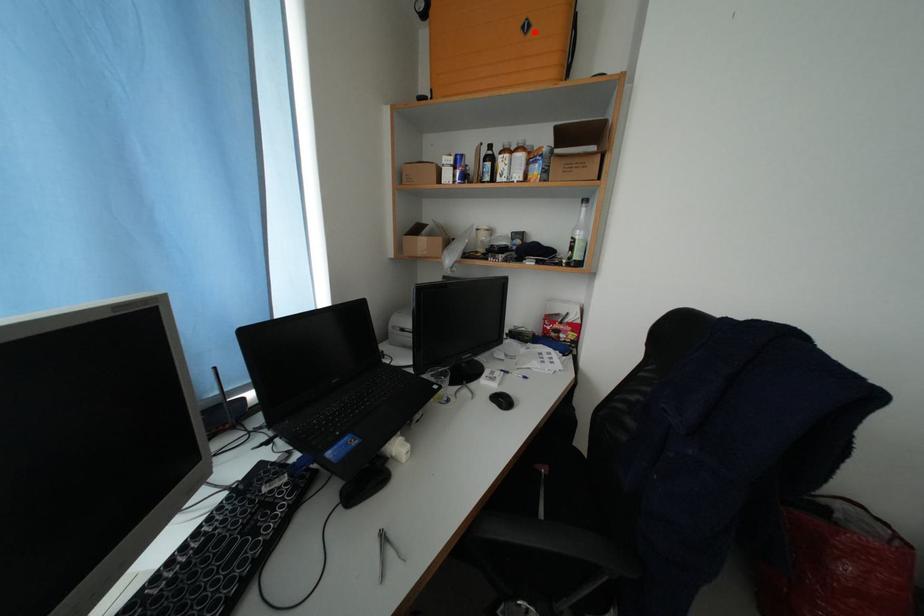
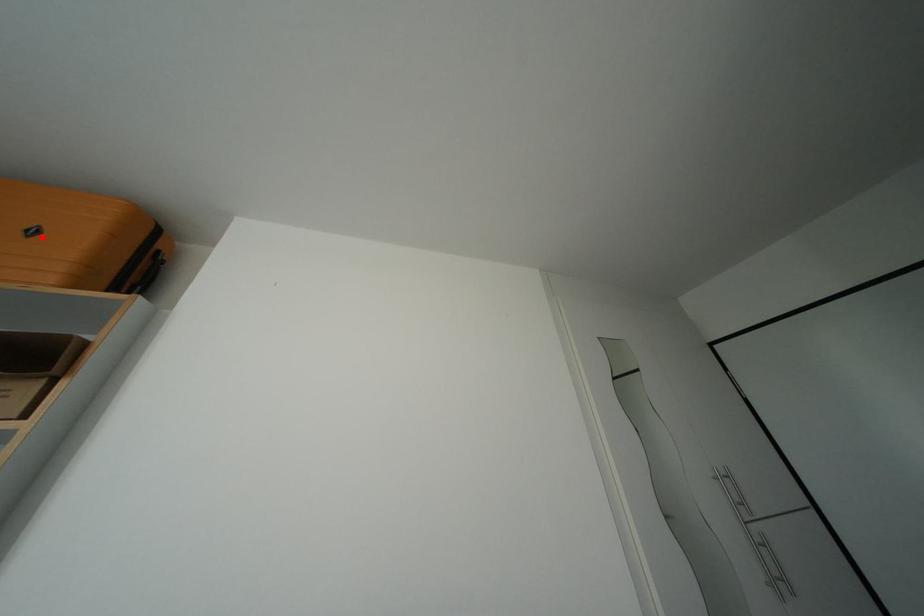
I am providing you with two images of the same scene from different viewpoints. A red point is marked on the first image and another point is marked on the second image. Is the red point in image1 aligned with the point shown in image2?

Yes